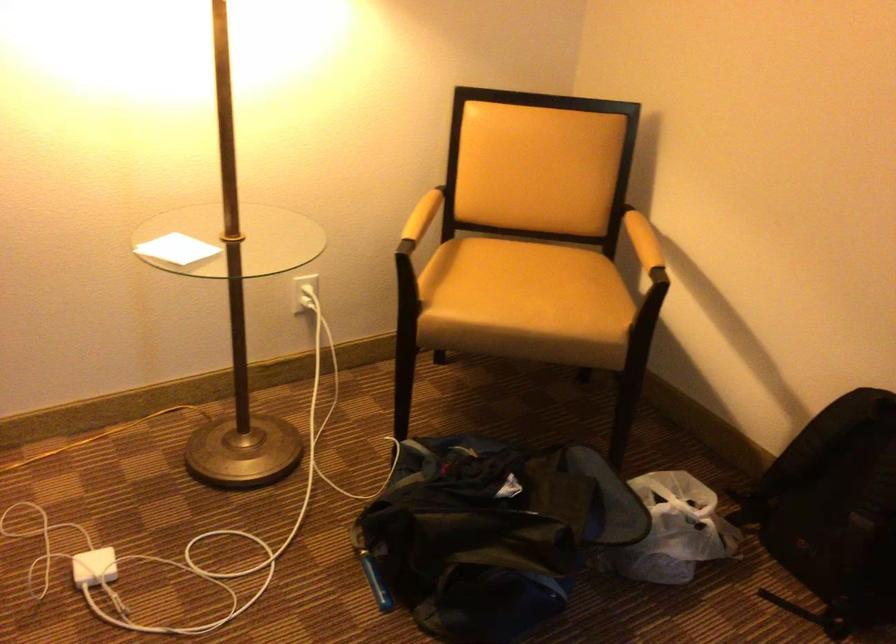
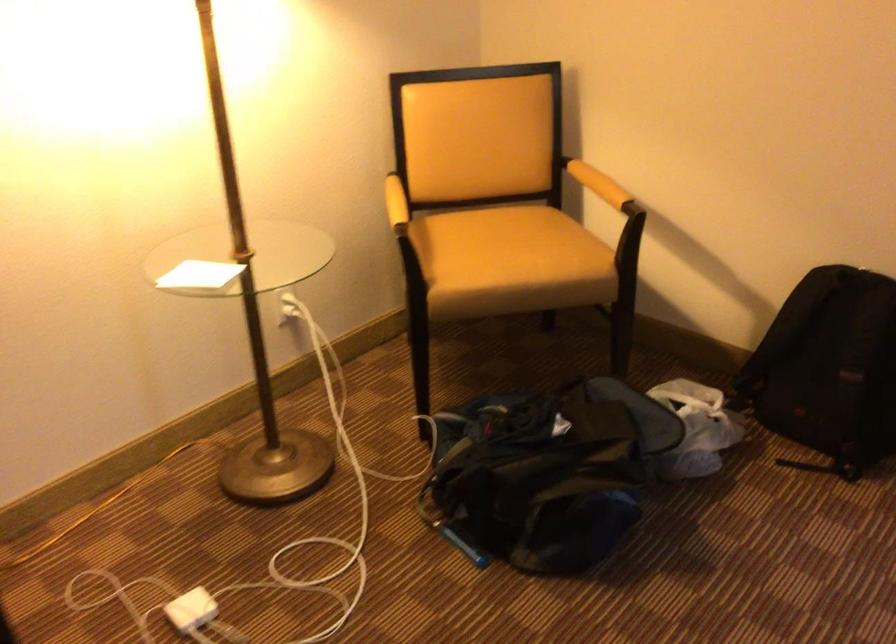
The point at (460, 538) is marked in the first image. Where is the corresponding point in the second image?

(537, 480)